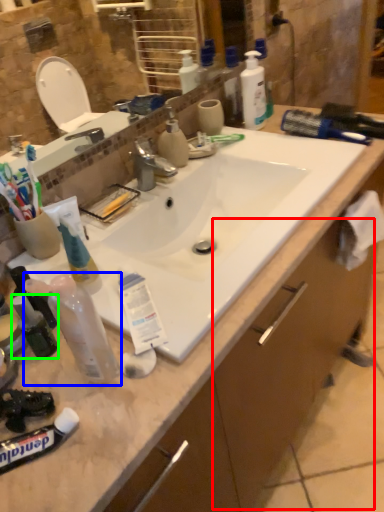
Question: Based on their relative distances, which object is nearer to drawer (highlighted by a red box)? Choose from toiletry (highlighted by a blue box) and mouthwash (highlighted by a green box).

Choices:
 (A) toiletry
 (B) mouthwash

Answer: (A)